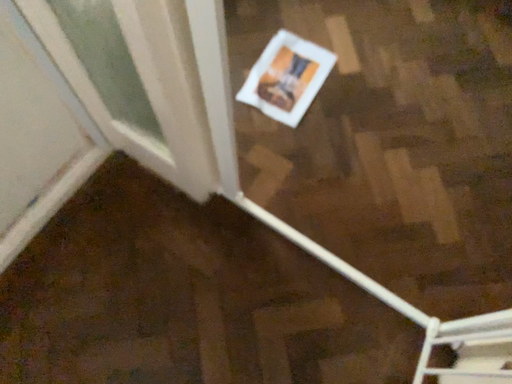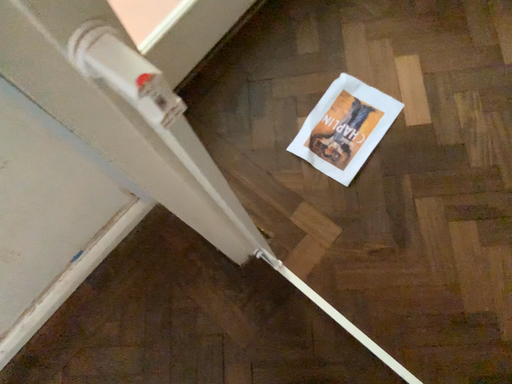
Question: How did the camera likely rotate when shooting the video?

Choices:
 (A) rotated left
 (B) rotated right

Answer: (A)